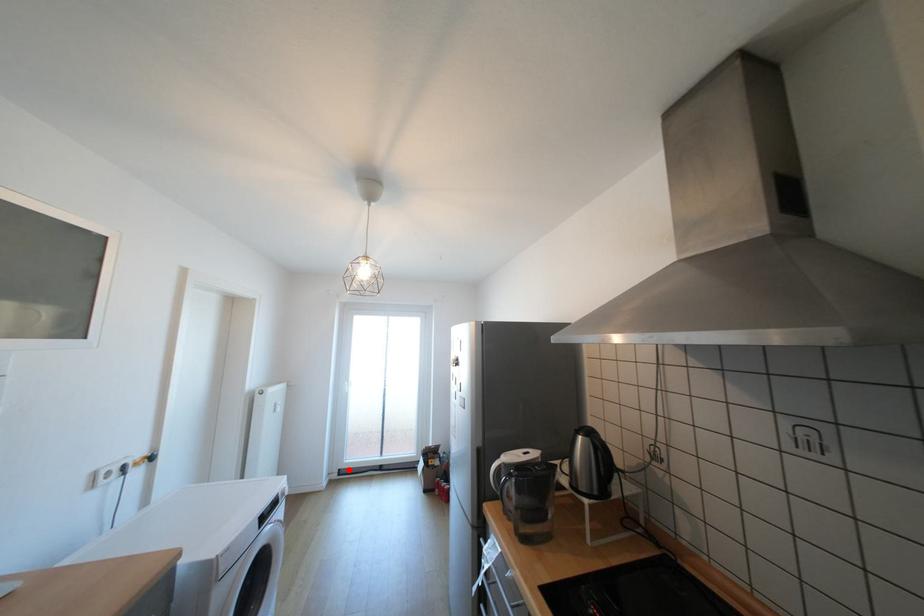
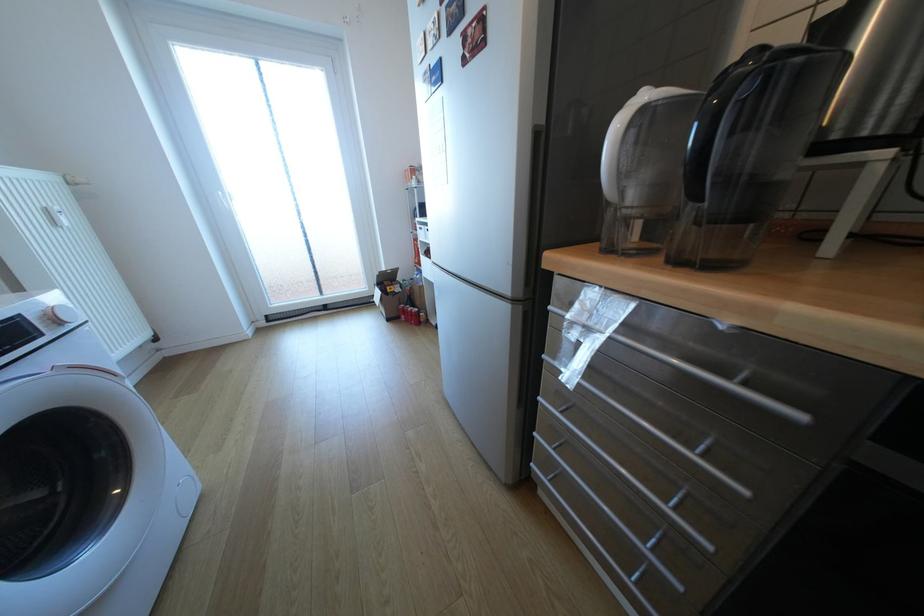
Question: A red point is marked in image1. In image2, is the corresponding 3D point closer to the camera or farther? Reply with the corresponding letter.

Choices:
 (A) The corresponding 3D point is closer.
 (B) The corresponding 3D point is farther.

Answer: (A)